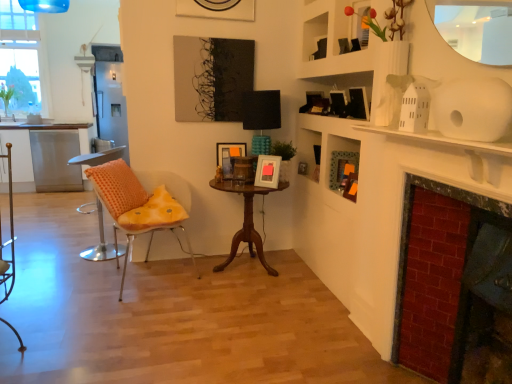
In order to face orange fabric chair at left, the 2th chair positioned from the left, should I rotate leftwards or rightwards?

Turn left approximately 14.352 degrees to face it.

How much space does matte wooden picture frame at center, the 1th picture frame positioned from the back, occupy horizontally?

matte wooden picture frame at center, the 1th picture frame positioned from the back, is 3.43 inches wide.

Locate an element on the screen. The height and width of the screenshot is (384, 512). metallic silver armchair at left is located at coordinates pos(10,237).

This screenshot has height=384, width=512. What do you see at coordinates (246, 221) in the screenshot? I see `mahogany wood table at center` at bounding box center [246, 221].

What do you see at coordinates (267, 171) in the screenshot? The image size is (512, 384). I see `wooden picture frame at center, acting as the 1th picture frame starting from the right` at bounding box center [267, 171].

What is the approximate width of wooden picture frame at center, positioned as the 1th picture frame in front-to-back order?

wooden picture frame at center, positioned as the 1th picture frame in front-to-back order, is 5.62 inches wide.

Find the location of `orange fabric chair at left, the 2th chair positioned from the left`. orange fabric chair at left, the 2th chair positioned from the left is located at coordinates click(x=136, y=207).

You are a GUI agent. You are given a task and a screenshot of the screen. Output one action in this format:
    pyautogui.click(x=<x>, y=<y>)
    Task: Click on the shelf below the wooden picture frame at center, positioned as the 1th picture frame in front-to-back order (from the image's perspective)
    This screenshot has width=512, height=384.
    Given the screenshot: What is the action you would take?
    pyautogui.click(x=345, y=170)

Consider the image. From a real-world perspective, is matte green frame at upper right positioned above or below wooden picture frame at center, the second picture frame positioned from the left?

In terms of real-world spatial position, matte green frame at upper right is above wooden picture frame at center, the second picture frame positioned from the left.

Based on their positions, is matte green frame at upper right located to the left or right of wooden picture frame at center, positioned as the 1th picture frame in front-to-back order?

Based on their positions, matte green frame at upper right is located to the right of wooden picture frame at center, positioned as the 1th picture frame in front-to-back order.

Would you say matte green frame at upper right is inside or outside wooden picture frame at center, positioned as the 1th picture frame in front-to-back order?

The correct answer is: outside.

Which is correct: orange dotted pillow at left is inside wooden picture frame at center, acting as the 1th picture frame starting from the right, or outside of it?

The correct answer is: outside.

Could you tell me if orange dotted pillow at left is turned towards wooden picture frame at center, acting as the 1th picture frame starting from the right?

No, orange dotted pillow at left is not oriented towards wooden picture frame at center, acting as the 1th picture frame starting from the right.

From a real-world perspective, is orange dotted pillow at left above or below wooden picture frame at center, positioned as the 2th picture frame in back-to-front order?

From a real-world perspective, orange dotted pillow at left is physically below wooden picture frame at center, positioned as the 2th picture frame in back-to-front order.

Is orange dotted pillow at left in contact with wooden picture frame at center, the second picture frame positioned from the left?

No, orange dotted pillow at left is not touching wooden picture frame at center, the second picture frame positioned from the left.

Is the position of metallic silver armchair at left less distant than that of orange fabric chair at left, the 2th chair positioned from the left?

Yes, the depth of metallic silver armchair at left is less than that of orange fabric chair at left, the 2th chair positioned from the left.

Is metallic silver armchair at left oriented towards orange fabric chair at left, which is the 1th chair in right-to-left order?

No, metallic silver armchair at left does not turn towards orange fabric chair at left, which is the 1th chair in right-to-left order.

Can you confirm if metallic silver armchair at left is positioned to the right of orange fabric chair at left, the 2th chair positioned from the left?

No, metallic silver armchair at left is not to the right of orange fabric chair at left, the 2th chair positioned from the left.

Based on the photo, is orange fabric chair at left, the 2th chair positioned from the left, bigger than orange dotted fabric chair at left, the 1th chair in the left-to-right sequence?

Yes, orange fabric chair at left, the 2th chair positioned from the left, is bigger than orange dotted fabric chair at left, the 1th chair in the left-to-right sequence.

From the image's perspective, is orange fabric chair at left, the 2th chair positioned from the left, above or below orange dotted fabric chair at left, arranged as the 2th chair when viewed from the right?

Based on their image positions, orange fabric chair at left, the 2th chair positioned from the left, is located beneath orange dotted fabric chair at left, arranged as the 2th chair when viewed from the right.

Does orange fabric chair at left, the 2th chair positioned from the left, turn towards orange dotted fabric chair at left, the 1th chair in the left-to-right sequence?

No, orange fabric chair at left, the 2th chair positioned from the left, is not facing towards orange dotted fabric chair at left, the 1th chair in the left-to-right sequence.

Based on their positions, is orange fabric chair at left, the 2th chair positioned from the left, located to the left or right of orange dotted fabric chair at left, arranged as the 2th chair when viewed from the right?

orange fabric chair at left, the 2th chair positioned from the left, is positioned on orange dotted fabric chair at left, arranged as the 2th chair when viewed from the right,'s right side.

Is red brick fireplace at right in contact with matte wooden picture frame at center, the 1th picture frame positioned from the back?

red brick fireplace at right and matte wooden picture frame at center, the 1th picture frame positioned from the back, are clearly separated.

From the red brick fireplace at right, count the 2nd picture frame to the left and point to it. Please provide its 2D coordinates.

[(229, 148)]

Is red brick fireplace at right at the left side of matte wooden picture frame at center, placed as the first picture frame when sorted from left to right?

No.

From the image's perspective, is metallic silver armchair at left over stainless steel cabinet at left?

No, from the image's perspective, metallic silver armchair at left is not above stainless steel cabinet at left.

Which object is closer to the camera, metallic silver armchair at left or stainless steel cabinet at left?

metallic silver armchair at left is in front.

Considering the relative positions of metallic silver armchair at left and stainless steel cabinet at left in the image provided, is metallic silver armchair at left to the left of stainless steel cabinet at left from the viewer's perspective?

Incorrect, metallic silver armchair at left is not on the left side of stainless steel cabinet at left.

How many degrees apart are the facing directions of metallic silver armchair at left and stainless steel cabinet at left?

metallic silver armchair at left and stainless steel cabinet at left are facing 76.9 degrees away from each other.

Is orange dotted pillow at left turned away from orange fabric chair at left, the 2th chair positioned from the left?

Yes.

Where is `chair in front of the orange dotted pillow at left`? chair in front of the orange dotted pillow at left is located at coordinates pyautogui.click(x=136, y=207).

From the image's perspective, is orange dotted pillow at left positioned above or below orange fabric chair at left, which is the 1th chair in right-to-left order?

From the image's perspective, orange dotted pillow at left appears above orange fabric chair at left, which is the 1th chair in right-to-left order.

Is orange dotted pillow at left not inside orange fabric chair at left, the 2th chair positioned from the left?

No.

You are a GUI agent. You are given a task and a screenshot of the screen. Output one action in this format:
    pyautogui.click(x=<x>, y=<y>)
    Task: Click on the shelf that is above the wooden picture frame at center, positioned as the 2th picture frame in back-to-front order (from a real-world perspective)
    The width and height of the screenshot is (512, 384).
    Given the screenshot: What is the action you would take?
    pyautogui.click(x=345, y=170)

This screenshot has width=512, height=384. What are the coordinates of `pillow below the wooden picture frame at center, positioned as the 2th picture frame in back-to-front order (from a real-world perspective)` in the screenshot? It's located at (117, 187).

Looking at the image, which one is located further to matte green frame at upper right, matte wooden picture frame at center, arranged as the 2th picture frame when viewed from the right, or wooden picture frame at center, positioned as the 2th picture frame in back-to-front order?

matte wooden picture frame at center, arranged as the 2th picture frame when viewed from the right.

Looking at the image, which one is located closer to matte wooden picture frame at center, arranged as the 2th picture frame when viewed from the right, orange dotted pillow at left or stainless steel cabinet at left?

orange dotted pillow at left lies closer to matte wooden picture frame at center, arranged as the 2th picture frame when viewed from the right, than the other object.

Considering their positions, is orange dotted fabric chair at left, the 1th chair in the left-to-right sequence, positioned closer to matte wooden picture frame at center, arranged as the 2th picture frame when viewed from the right, than orange fabric chair at left, the 2th chair positioned from the left?

The object closer to matte wooden picture frame at center, arranged as the 2th picture frame when viewed from the right, is orange fabric chair at left, the 2th chair positioned from the left.

Looking at the image, which one is located closer to orange dotted fabric chair at left, the 1th chair in the left-to-right sequence, mahogany wood table at center or matte wooden picture frame at center, placed as the first picture frame when sorted from left to right?

mahogany wood table at center is closer to orange dotted fabric chair at left, the 1th chair in the left-to-right sequence.

Considering their positions, is metallic silver armchair at left positioned further to mahogany wood table at center than wooden picture frame at center, positioned as the 1th picture frame in front-to-back order?

metallic silver armchair at left.

Estimate the real-world distances between objects in this image. Which object is closer to orange dotted pillow at left, orange fabric chair at left, the 2th chair positioned from the left, or mahogany wood table at center?

The object closer to orange dotted pillow at left is orange fabric chair at left, the 2th chair positioned from the left.

Which object lies further to the anchor point stainless steel cabinet at left, orange dotted pillow at left or orange fabric chair at left, which is the 1th chair in right-to-left order?

orange fabric chair at left, which is the 1th chair in right-to-left order, is further to stainless steel cabinet at left.

When comparing their distances from red brick fireplace at right, does matte green frame at upper right or wooden picture frame at center, the second picture frame positioned from the left, seem closer?

matte green frame at upper right lies closer to red brick fireplace at right than the other object.

Where is `cabinetry positioned between red brick fireplace at right and transparent glass window at upper left from near to far`? This screenshot has height=384, width=512. cabinetry positioned between red brick fireplace at right and transparent glass window at upper left from near to far is located at coordinates (46, 155).

Locate an element on the screen. The image size is (512, 384). table between transparent glass window at upper left and wooden picture frame at center, acting as the 1th picture frame starting from the right is located at coordinates (246, 221).

I want to click on chair situated between orange dotted pillow at left and mahogany wood table at center from left to right, so click(x=136, y=207).

Identify the location of cabinetry located between transparent glass window at upper left and mahogany wood table at center in the left-right direction. (46, 155).